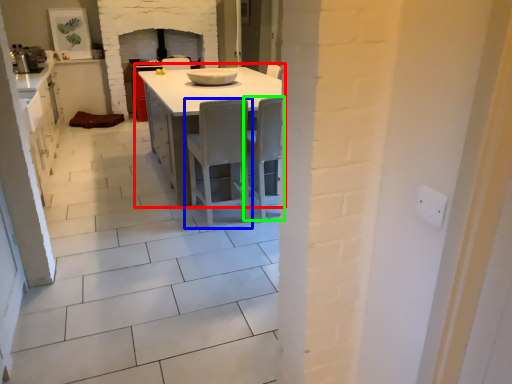
Question: Based on their relative distances, which object is nearer to table (highlighted by a red box)? Choose from chair (highlighted by a blue box) and chair (highlighted by a green box).

Choices:
 (A) chair
 (B) chair

Answer: (A)